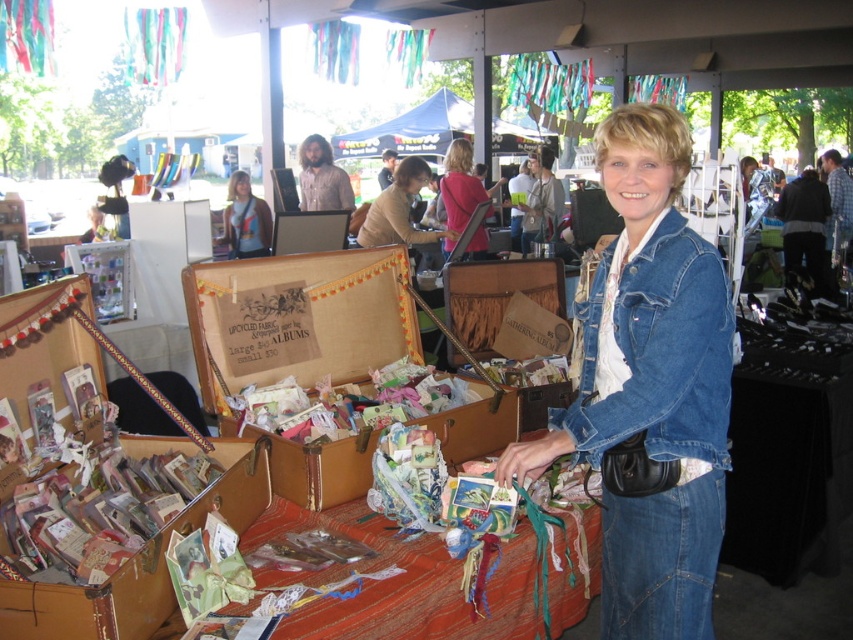
Which is in front, point (643, 556) or point (471, 140)?

Positioned in front is point (643, 556).

Is denim jacket at lower right to the left of blue fabric canopy at upper center from the viewer's perspective?

Incorrect, denim jacket at lower right is not on the left side of blue fabric canopy at upper center.

Does point (635, 429) come closer to viewer compared to point (437, 148)?

Yes, point (635, 429) is closer to viewer.

Identify the location of denim jacket at lower right. (650, 387).

Is brown leather suitcase at center to the right of blue fabric canopy at upper center from the viewer's perspective?

Correct, you'll find brown leather suitcase at center to the right of blue fabric canopy at upper center.

In the scene shown: Is brown leather suitcase at center taller than blue fabric canopy at upper center?

In fact, brown leather suitcase at center may be shorter than blue fabric canopy at upper center.

Image resolution: width=853 pixels, height=640 pixels. Describe the element at coordinates (312, 314) in the screenshot. I see `brown leather suitcase at center` at that location.

The width and height of the screenshot is (853, 640). I want to click on brown leather suitcase at center, so click(x=312, y=314).

How distant is pink fabric at center from light brown leather jacket at center?

pink fabric at center is 1.89 meters from light brown leather jacket at center.

Can you confirm if pink fabric at center is positioned to the right of light brown leather jacket at center?

Correct, you'll find pink fabric at center to the right of light brown leather jacket at center.

Measure the distance between pink fabric at center and camera.

pink fabric at center and camera are 16.06 feet apart.

The image size is (853, 640). I want to click on pink fabric at center, so click(x=459, y=186).